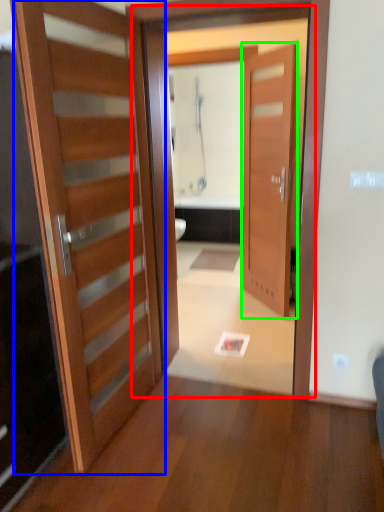
Question: Which object is the closest to the screen door (highlighted by a red box)? Choose among these: door (highlighted by a blue box) or door (highlighted by a green box).

Choices:
 (A) door
 (B) door

Answer: (A)